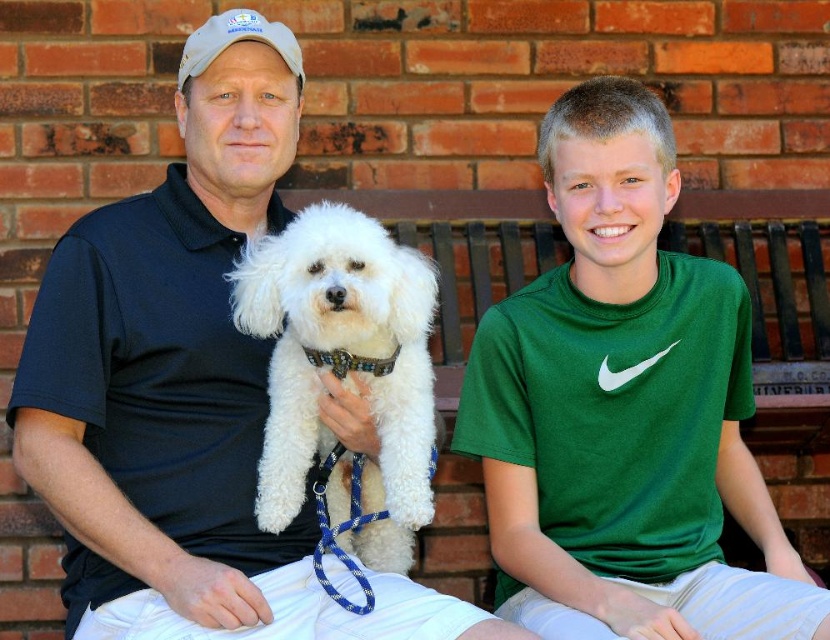
You are standing at the camera position and want to pick up the green cotton shirt at center. Can you reach it without moving your feet?

The green cotton shirt at center is 2.45 meters away from the camera, so you cannot reach it without moving your feet.

You are a photographer trying to capture a clear photo of the white fluffy dog at center. You notice there is a green cotton shirt at center in the frame. Considering their heights, which object should be placed lower in the frame to ensure the dog is fully visible?

The green cotton shirt at center is taller than the white fluffy dog at center. To ensure the dog is fully visible, the green cotton shirt at center should be placed lower in the frame so it doesn

You are standing in front of the brick wall and want to place a small decorative item on the bench where the person is sitting. You have two options to choose from. One is placed at point A, which is at coordinates point (x=420, y=637), and the other is at point B, which is at coordinates point (x=306, y=410). Which point is closer to you so that the item will be more visible?

Point A at coordinates point (x=420, y=637) is closer to the viewer than point B at coordinates point (x=306, y=410). Therefore, placing the item at point A would make it more visible.